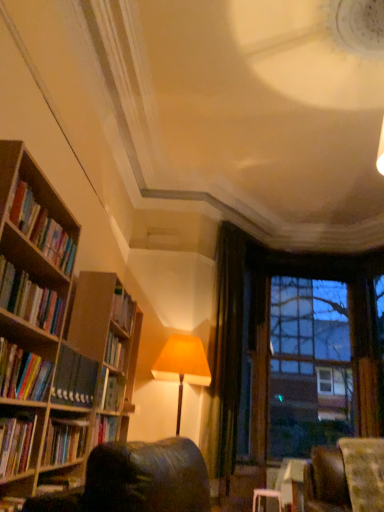
Question: Should I look upward or downward to see hardcover books at left, the 3th book positioned from the top?

Choices:
 (A) up
 (B) down

Answer: (B)

Question: Is matte yellow lampshade at center not close to hardcover books at left, the fifth book when ordered from bottom to top?

Choices:
 (A) no
 (B) yes

Answer: (B)

Question: From a real-world perspective, is matte yellow lampshade at center located higher than hardcover books at left, which appears as the first book when viewed from the top?

Choices:
 (A) yes
 (B) no

Answer: (B)

Question: Does matte yellow lampshade at center turn towards hardcover books at left, the fifth book when ordered from bottom to top?

Choices:
 (A) yes
 (B) no

Answer: (A)

Question: Considering the relative positions of matte yellow lampshade at center and hardcover books at left, which appears as the first book when viewed from the top, in the image provided, is matte yellow lampshade at center to the left of hardcover books at left, which appears as the first book when viewed from the top, from the viewer's perspective?

Choices:
 (A) yes
 (B) no

Answer: (B)

Question: Is matte yellow lampshade at center completely or partially outside of hardcover books at left, which appears as the first book when viewed from the top?

Choices:
 (A) yes
 (B) no

Answer: (A)

Question: From the image's perspective, is matte yellow lampshade at center below hardcover books at left, the fifth book when ordered from bottom to top?

Choices:
 (A) no
 (B) yes

Answer: (B)

Question: Does matte yellow lampshade at center lie in front of green velvet curtain at center?

Choices:
 (A) no
 (B) yes

Answer: (B)

Question: Is matte yellow lampshade at center behind green velvet curtain at center?

Choices:
 (A) no
 (B) yes

Answer: (A)

Question: Is there a large distance between matte yellow lampshade at center and green velvet curtain at center?

Choices:
 (A) yes
 (B) no

Answer: (B)

Question: Does matte yellow lampshade at center have a greater height compared to green velvet curtain at center?

Choices:
 (A) no
 (B) yes

Answer: (A)

Question: From a real-world perspective, is matte yellow lampshade at center over green velvet curtain at center?

Choices:
 (A) no
 (B) yes

Answer: (A)

Question: Considering the relative sizes of matte yellow lampshade at center and green velvet curtain at center in the image provided, is matte yellow lampshade at center bigger than green velvet curtain at center?

Choices:
 (A) yes
 (B) no

Answer: (A)

Question: Would you say hardcover books at left, which appears as the first book when viewed from the top, is part of green velvet curtain at center's contents?

Choices:
 (A) yes
 (B) no

Answer: (B)